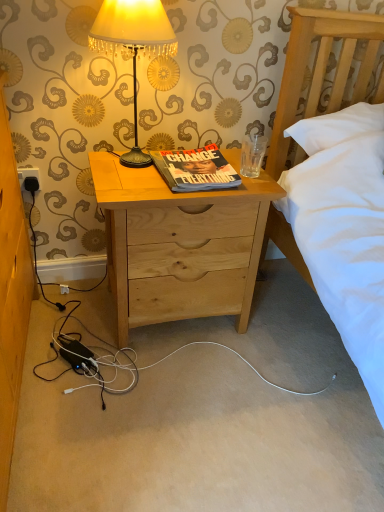
Identify the location of free point to the left of hardcover book at center. The height and width of the screenshot is (512, 384). (x=128, y=170).